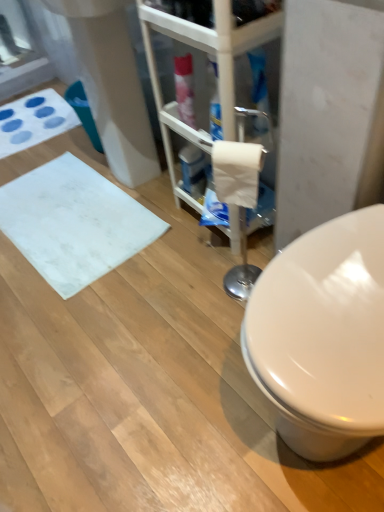
The width and height of the screenshot is (384, 512). In order to click on white matte bath mat at upper left, positioned as the 2th bath mat in front-to-back order in this screenshot , I will do point(34,120).

The image size is (384, 512). What do you see at coordinates (237, 172) in the screenshot?
I see `white matte toilet paper at center` at bounding box center [237, 172].

This screenshot has height=512, width=384. I want to click on white matte bath mat at upper left, positioned as the 2th bath mat in front-to-back order, so click(x=34, y=120).

How distant is white matte bath mat at upper left, placed as the first bath mat when sorted from top to bottom, from white plastic shelf at center?

A distance of 37.71 inches exists between white matte bath mat at upper left, placed as the first bath mat when sorted from top to bottom, and white plastic shelf at center.

Is white matte bath mat at upper left, positioned as the 2th bath mat in front-to-back order, further to the viewer compared to white plastic shelf at center?

Yes, white matte bath mat at upper left, positioned as the 2th bath mat in front-to-back order, is behind white plastic shelf at center.

Is white matte bath mat at upper left, the first bath mat when ordered from back to front, located outside white plastic shelf at center?

Yes.

From the image's perspective, which one is positioned higher, white matte toilet paper at center or white plastic shelf at center?

white plastic shelf at center appears higher in the image.

Is point (219, 149) positioned before point (235, 241)?

Yes.

Can you confirm if white matte toilet paper at center is positioned to the left of white plastic shelf at center?

Incorrect, white matte toilet paper at center is not on the left side of white plastic shelf at center.

Is white matte toilet paper at center facing away from white plastic shelf at center?

Yes, white matte toilet paper at center's orientation is away from white plastic shelf at center.

The width and height of the screenshot is (384, 512). Find the location of `shelf on the right of white matte bath mat at lower left, the 1th bath mat viewed from the front`. shelf on the right of white matte bath mat at lower left, the 1th bath mat viewed from the front is located at coordinates (218, 69).

Is white plastic shelf at center closer to camera compared to white matte bath mat at lower left, the 1th bath mat viewed from the front?

Yes, white plastic shelf at center is in front of white matte bath mat at lower left, the 1th bath mat viewed from the front.

Is white plastic shelf at center not close to white matte bath mat at lower left, arranged as the second bath mat when viewed from the top?

They are positioned close to each other.

From a real-world perspective, who is located lower, white plastic shelf at center or white matte bath mat at lower left, the 1th bath mat in the bottom-to-top sequence?

white matte bath mat at lower left, the 1th bath mat in the bottom-to-top sequence, is physically lower.

Could you tell me if white matte toilet paper at center is facing white matte bath mat at lower left, the 1th bath mat viewed from the front?

No, white matte toilet paper at center does not turn towards white matte bath mat at lower left, the 1th bath mat viewed from the front.

Is white matte toilet paper at center completely or partially outside of white matte bath mat at lower left, arranged as the second bath mat when viewed from the top?

Indeed, white matte toilet paper at center is completely outside white matte bath mat at lower left, arranged as the second bath mat when viewed from the top.

From the image's perspective, between white matte toilet paper at center and white matte bath mat at lower left, the 1th bath mat viewed from the front, which one is located above?

white matte toilet paper at center.

Find the location of `toilet paper lying in front of the white matte bath mat at lower left, the 1th bath mat in the bottom-to-top sequence`. toilet paper lying in front of the white matte bath mat at lower left, the 1th bath mat in the bottom-to-top sequence is located at coordinates (237, 172).

In the scene shown: Are white matte bath mat at lower left, the 1th bath mat in the bottom-to-top sequence, and white matte toilet paper at center making contact?

No, white matte bath mat at lower left, the 1th bath mat in the bottom-to-top sequence, is not next to white matte toilet paper at center.

Consider the image. Considering the relative sizes of white matte bath mat at lower left, arranged as the second bath mat when viewed from the top, and white matte toilet paper at center in the image provided, is white matte bath mat at lower left, arranged as the second bath mat when viewed from the top, wider than white matte toilet paper at center?

Correct, the width of white matte bath mat at lower left, arranged as the second bath mat when viewed from the top, exceeds that of white matte toilet paper at center.

Which is more distant, (80, 186) or (262, 151)?

The point (80, 186) is farther.

Can you confirm if white matte bath mat at upper left, the 2th bath mat when ordered from bottom to top, is shorter than white matte bath mat at lower left, arranged as the second bath mat when viewed from the top?

No.

Can you confirm if white matte bath mat at upper left, positioned as the 2th bath mat in front-to-back order, is thinner than white matte bath mat at lower left, arranged as the second bath mat when viewed from the top?

Incorrect, the width of white matte bath mat at upper left, positioned as the 2th bath mat in front-to-back order, is not less than that of white matte bath mat at lower left, arranged as the second bath mat when viewed from the top.

Can you confirm if white matte bath mat at upper left, placed as the first bath mat when sorted from top to bottom, is positioned to the right of white matte bath mat at lower left, the 1th bath mat viewed from the front?

No, white matte bath mat at upper left, placed as the first bath mat when sorted from top to bottom, is not to the right of white matte bath mat at lower left, the 1th bath mat viewed from the front.

From a real-world perspective, which is physically above, white plastic shelf at center or white matte toilet paper at center?

In real-world perspective, white matte toilet paper at center is above.

Visually, is white plastic shelf at center positioned to the left or to the right of white matte toilet paper at center?

Clearly, white plastic shelf at center is on the left of white matte toilet paper at center in the image.

Is white plastic shelf at center in front of white matte toilet paper at center?

Yes, white plastic shelf at center is in front of white matte toilet paper at center.

Consider the image. Looking at the image, does white plastic shelf at center seem bigger or smaller compared to white matte toilet paper at center?

Considering their sizes, white plastic shelf at center takes up more space than white matte toilet paper at center.

This screenshot has height=512, width=384. What are the coordinates of `the 1st bath mat directly beneath the white plastic shelf at center (from a real-world perspective)` in the screenshot? It's located at (34, 120).

In order to click on toilet paper on the right of the white plastic shelf at center in this screenshot , I will do `click(237, 172)`.

When comparing their distances from white matte bath mat at upper left, the 2th bath mat when ordered from bottom to top, does white matte toilet paper at center or white matte bath mat at lower left, which is counted as the second bath mat, starting from the back, seem closer?

white matte bath mat at lower left, which is counted as the second bath mat, starting from the back, is positioned closer to the anchor white matte bath mat at upper left, the 2th bath mat when ordered from bottom to top.

Looking at the image, which one is located further to white plastic shelf at center, white matte bath mat at lower left, the 1th bath mat in the bottom-to-top sequence, or white matte toilet paper at center?

white matte bath mat at lower left, the 1th bath mat in the bottom-to-top sequence, is further to white plastic shelf at center.

From the image, which object appears to be farther from white matte bath mat at upper left, placed as the first bath mat when sorted from top to bottom, white plastic shelf at center or white matte bath mat at lower left, the 1th bath mat in the bottom-to-top sequence?

The object further to white matte bath mat at upper left, placed as the first bath mat when sorted from top to bottom, is white plastic shelf at center.

When comparing their distances from white matte bath mat at lower left, which is counted as the second bath mat, starting from the back, does white matte toilet paper at center or white plastic shelf at center seem closer?

Based on the image, white plastic shelf at center appears to be nearer to white matte bath mat at lower left, which is counted as the second bath mat, starting from the back.

Which object lies further to the anchor point white matte toilet paper at center, white plastic shelf at center or white matte bath mat at lower left, which is counted as the second bath mat, starting from the back?

white matte bath mat at lower left, which is counted as the second bath mat, starting from the back.

From the picture: Based on their spatial positions, is white matte bath mat at upper left, the 2th bath mat when ordered from bottom to top, or white plastic shelf at center further from white matte toilet paper at center?

Among the two, white matte bath mat at upper left, the 2th bath mat when ordered from bottom to top, is located further to white matte toilet paper at center.

Considering their positions, is white matte toilet paper at center positioned closer to white matte bath mat at lower left, which is counted as the second bath mat, starting from the back, than white matte bath mat at upper left, positioned as the 2th bath mat in front-to-back order?

Based on the image, white matte bath mat at upper left, positioned as the 2th bath mat in front-to-back order, appears to be nearer to white matte bath mat at lower left, which is counted as the second bath mat, starting from the back.

Looking at this image, considering their positions, is white matte toilet paper at center positioned further to white plastic shelf at center than white matte bath mat at lower left, the 1th bath mat viewed from the front?

white matte bath mat at lower left, the 1th bath mat viewed from the front.

This screenshot has width=384, height=512. In order to click on shelf located between white matte bath mat at lower left, the 1th bath mat in the bottom-to-top sequence, and white matte toilet paper at center in the left-right direction in this screenshot , I will do `click(218, 69)`.

You are a GUI agent. You are given a task and a screenshot of the screen. Output one action in this format:
    pyautogui.click(x=<x>, y=<y>)
    Task: Click on the toilet paper located between white plastic shelf at center and white matte bath mat at upper left, placed as the first bath mat when sorted from top to bottom, in the depth direction
    This screenshot has width=384, height=512.
    Given the screenshot: What is the action you would take?
    pyautogui.click(x=237, y=172)

The height and width of the screenshot is (512, 384). I want to click on bath mat positioned between white plastic shelf at center and white matte bath mat at upper left, the 2th bath mat when ordered from bottom to top, from near to far, so click(x=74, y=223).

Where is `bath mat between white matte toilet paper at center and white matte bath mat at upper left, the 2th bath mat when ordered from bottom to top, in the front-back direction`? Image resolution: width=384 pixels, height=512 pixels. bath mat between white matte toilet paper at center and white matte bath mat at upper left, the 2th bath mat when ordered from bottom to top, in the front-back direction is located at coordinates (74, 223).